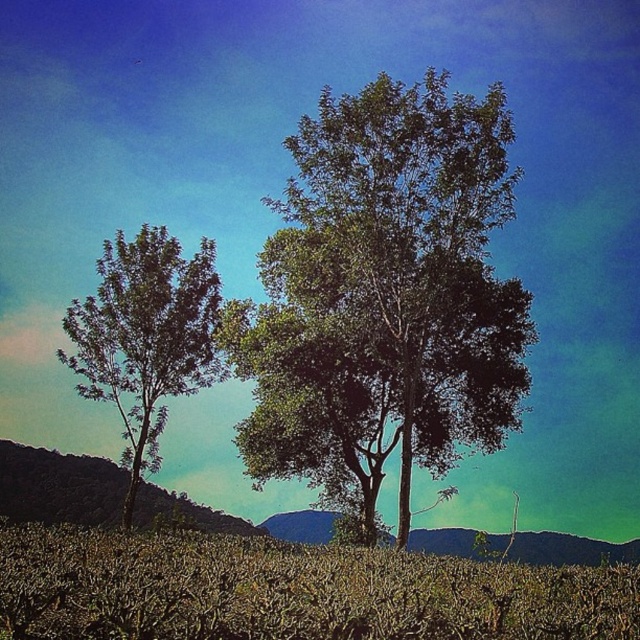
Based on the photo, you are a hiker who wants to take a photo of the dark green foliage at left without the brown dry grass at lower center blocking the view. How should you position yourself relative to the trees?

The brown dry grass at lower center is in front of the dark green foliage at left, so to avoid blocking the view, you should move behind the dark green foliage at left so that the brown dry grass at lower center is no longer between you and the foliage.

You are an artist trying to sketch the scene. You need to place the green leafy tree at center and the dark green foliage at left in your drawing. According to the image, which one should you draw first if you want to follow the left to right direction?

The dark green foliage at left should be drawn first since it is positioned to the left of the green leafy tree at center.

You are a gardener planning to mow the brown dry grass at lower center and trim the dark green foliage at left. Which area requires a wider path for your equipment?

The brown dry grass at lower center requires a wider path for your equipment since its width surpasses that of the dark green foliage at left.